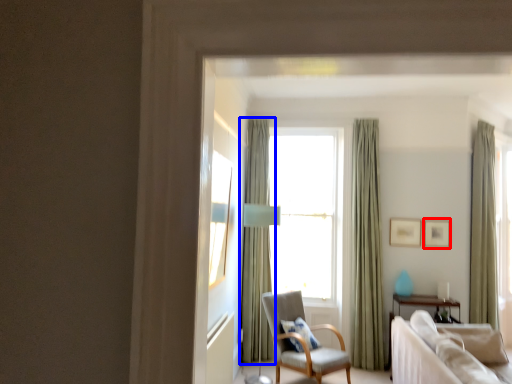
Question: Which object is further to the camera taking this photo, picture frame (highlighted by a red box) or curtain (highlighted by a blue box)?

Choices:
 (A) picture frame
 (B) curtain

Answer: (A)